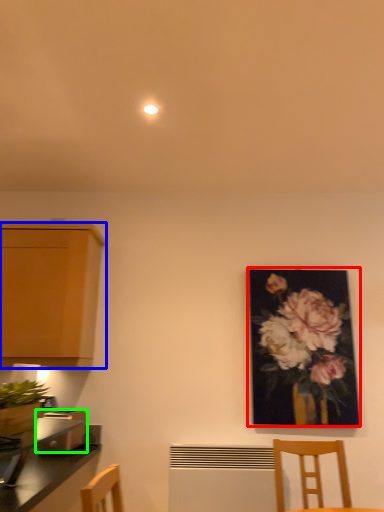
Question: Which is nearer to the picture frame (highlighted by a red box)? cabinetry (highlighted by a blue box) or toaster (highlighted by a green box).

Choices:
 (A) cabinetry
 (B) toaster

Answer: (A)